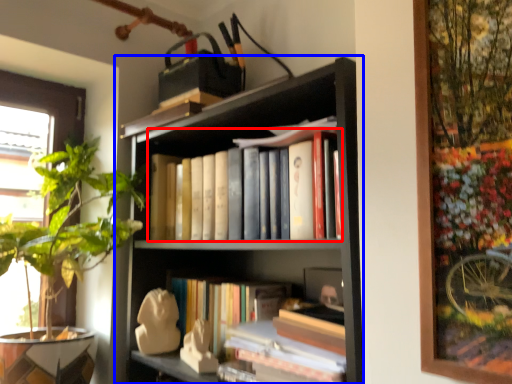
Question: Which of the following is the closest to the observer, book (highlighted by a red box) or bookcase (highlighted by a blue box)?

Choices:
 (A) book
 (B) bookcase

Answer: (B)